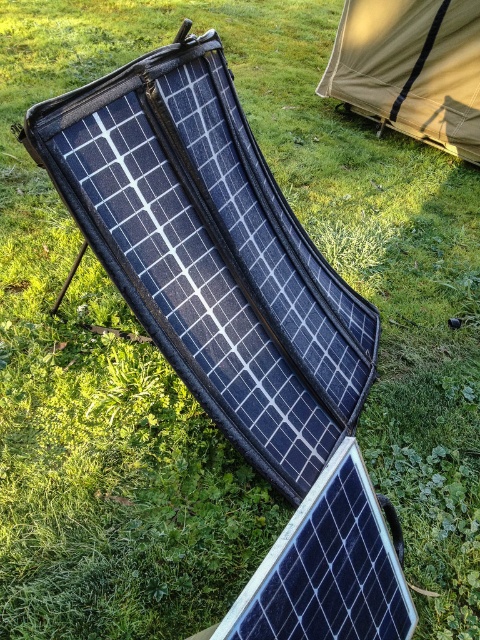
Does black textured solar panel at center appear over tan canvas tent at upper right?

No, black textured solar panel at center is not above tan canvas tent at upper right.

Can you confirm if black textured solar panel at center is smaller than tan canvas tent at upper right?

Indeed, black textured solar panel at center has a smaller size compared to tan canvas tent at upper right.

You are a GUI agent. You are given a task and a screenshot of the screen. Output one action in this format:
    pyautogui.click(x=<x>, y=<y>)
    Task: Click on the black textured solar panel at center
    
    Given the screenshot: What is the action you would take?
    pyautogui.click(x=327, y=568)